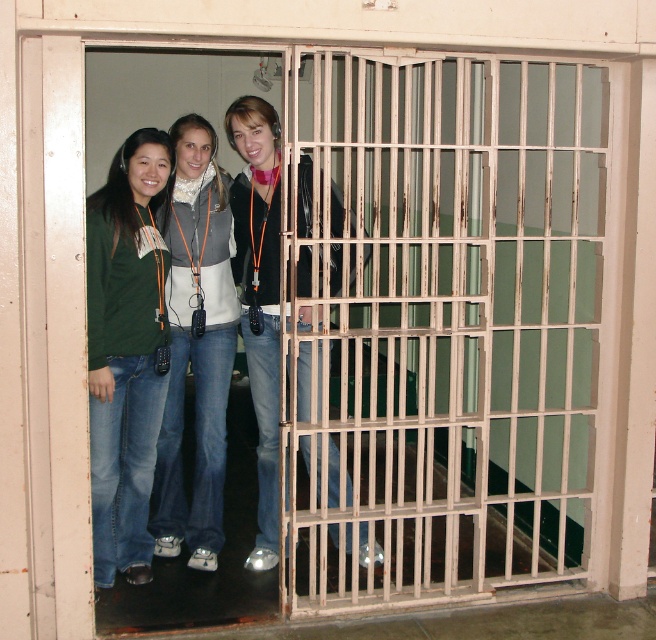
Is rusty metal bars at center bigger than matte green shirt at center?

Indeed, rusty metal bars at center has a larger size compared to matte green shirt at center.

Is rusty metal bars at center behind matte green shirt at center?

No, rusty metal bars at center is closer to the viewer.

This screenshot has height=640, width=656. In order to click on rusty metal bars at center in this screenshot , I will do `click(445, 323)`.

This screenshot has height=640, width=656. Identify the location of rusty metal bars at center. (445, 323).

In the scene shown: Who is positioned more to the left, rusty metal bars at center or denim jeans at center?

From the viewer's perspective, denim jeans at center appears more on the left side.

Is rusty metal bars at center positioned in front of denim jeans at center?

Yes.

Who is more forward, [502,358] or [169,218]?

Positioned in front is point [169,218].

Find the location of a particular element. rusty metal bars at center is located at coordinates (445, 323).

Can you confirm if rusty metal bars at center is positioned above matte black jacket at center?

Yes.

Which is below, rusty metal bars at center or matte black jacket at center?

matte black jacket at center is below.

Locate an element on the screen. The width and height of the screenshot is (656, 640). rusty metal bars at center is located at coordinates (445, 323).